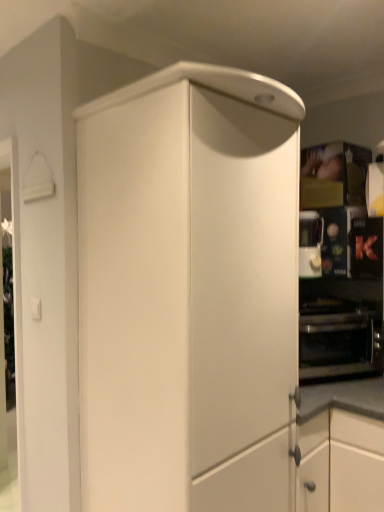
Question: Choose the correct answer: Is black matte oven at right inside satin silver coffee machine at right or outside it?

Choices:
 (A) inside
 (B) outside

Answer: (B)

Question: From the image's perspective, is black matte oven at right above or below satin silver coffee machine at right?

Choices:
 (A) below
 (B) above

Answer: (A)

Question: Which of these objects is positioned farthest from the matte white cabinet at center?

Choices:
 (A) satin silver coffee machine at right
 (B) black matte oven at right
 (C) black metallic oven at right

Answer: (B)

Question: Considering the real-world distances, which object is farthest from the black metallic oven at right?

Choices:
 (A) matte white cabinet at center
 (B) satin silver coffee machine at right
 (C) black matte oven at right

Answer: (A)